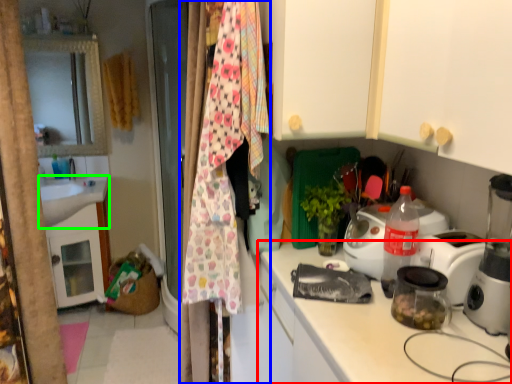
Question: Which is farther away from countertop (highlighted by a red box)? clothesline (highlighted by a blue box) or sink (highlighted by a green box)?

Choices:
 (A) clothesline
 (B) sink

Answer: (B)